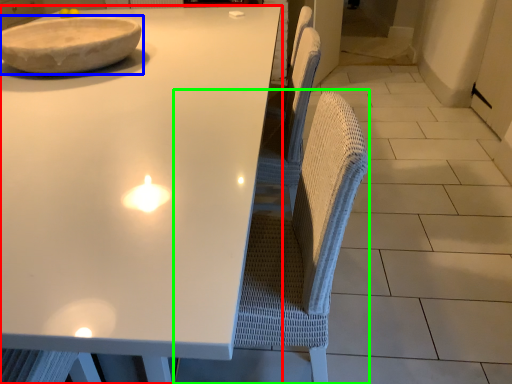
Question: Considering the real-world distances, which object is farthest from table (highlighted by a red box)? bowl (highlighted by a blue box) or swivel chair (highlighted by a green box)?

Choices:
 (A) bowl
 (B) swivel chair

Answer: (B)